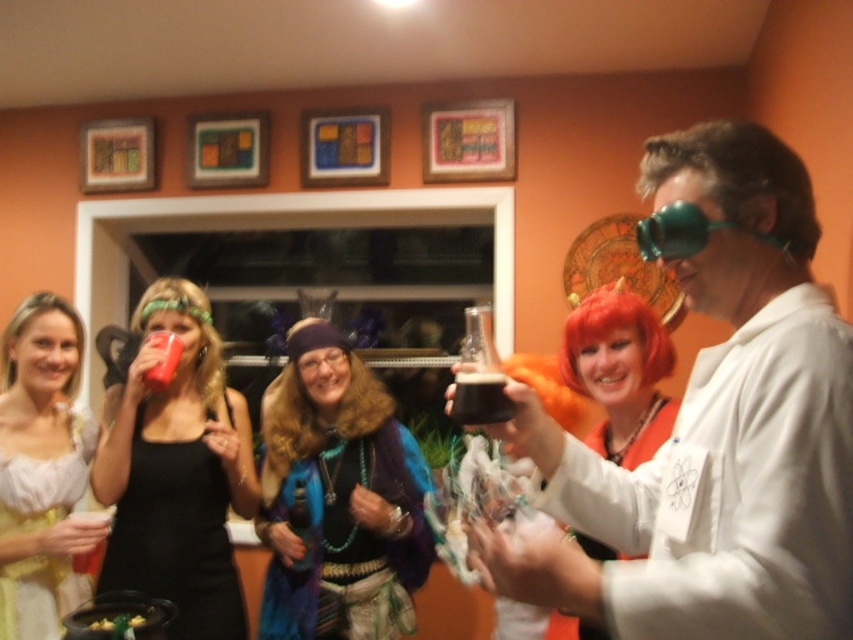
Is red synthetic wig at upper right taller than green matte goggles at upper right?

Yes, red synthetic wig at upper right is taller than green matte goggles at upper right.

Is point (650, 381) farther from camera compared to point (668, 208)?

Yes, it is behind point (668, 208).

Where is `red synthetic wig at upper right`? This screenshot has width=853, height=640. red synthetic wig at upper right is located at coordinates (614, 330).

This screenshot has height=640, width=853. What do you see at coordinates (177, 472) in the screenshot? I see `matte black dress at center` at bounding box center [177, 472].

Can you confirm if matte black dress at center is positioned to the left of green matte wig at upper right?

Yes, matte black dress at center is to the left of green matte wig at upper right.

Is point (103, 493) more distant than point (740, 144)?

Yes, point (103, 493) is farther from viewer.

I want to click on matte black dress at center, so click(177, 472).

Between green matte wig at upper right and red synthetic wig at upper right, which one appears on the left side from the viewer's perspective?

→ green matte wig at upper right

Measure the distance between green matte wig at upper right and red synthetic wig at upper right.

green matte wig at upper right is 64.64 centimeters away from red synthetic wig at upper right.

Locate an element on the screen. This screenshot has width=853, height=640. green matte wig at upper right is located at coordinates (740, 179).